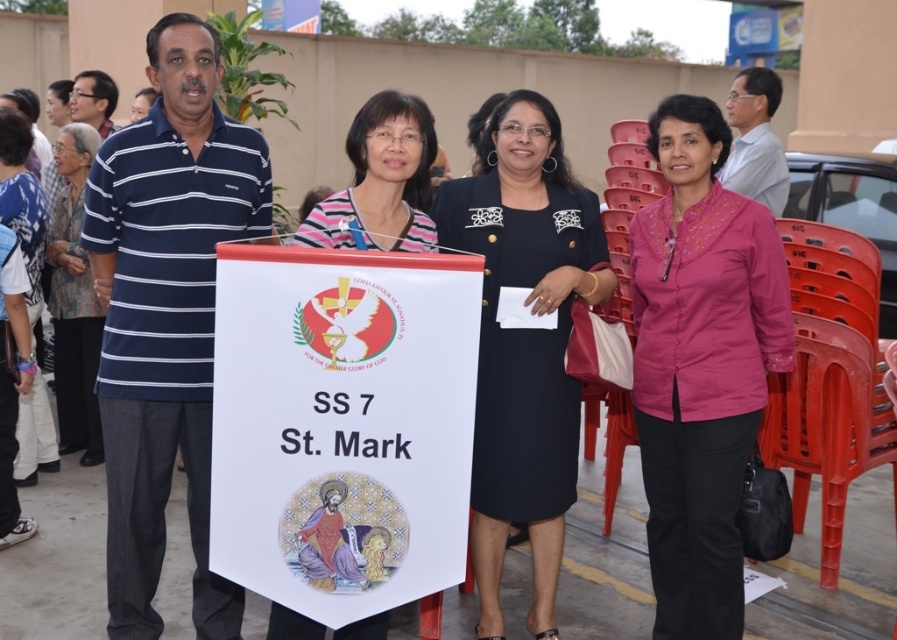
Question: Which point is closer to the camera?

Choices:
 (A) (663, 540)
 (B) (62, 250)
 (C) (216, 156)
 (D) (512, 180)

Answer: (C)

Question: Is striped fabric shirt at center below white shirt at upper right?

Choices:
 (A) yes
 (B) no

Answer: (A)

Question: Can you confirm if black satin dress at center is bigger than striped fabric shirt at center?

Choices:
 (A) yes
 (B) no

Answer: (A)

Question: Which of these objects is positioned farthest from the white shirt at upper right?

Choices:
 (A) patterned fabric blouse at left
 (B) black satin dress at center

Answer: (A)

Question: Does blue striped polo shirt at left lie in front of black satin dress at center?

Choices:
 (A) no
 (B) yes

Answer: (B)

Question: Which point is farther from the camera taking this photo?

Choices:
 (A) (336, 232)
 (B) (70, 333)
 (C) (382, 614)
 (D) (36, 264)

Answer: (B)